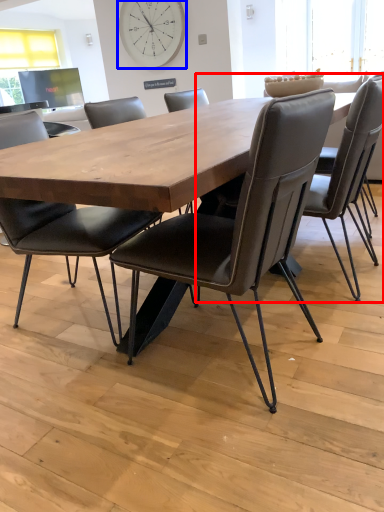
Question: Which point is further to the camera, chair (highlighted by a red box) or clock (highlighted by a blue box)?

Choices:
 (A) chair
 (B) clock

Answer: (B)